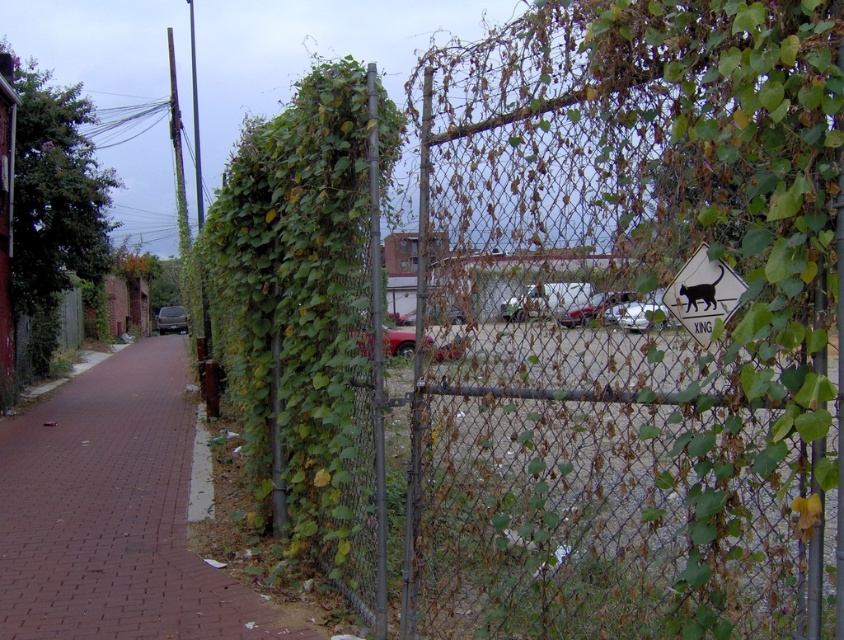
Is brick pavement at lower left above metallic red car at center?

Actually, brick pavement at lower left is below metallic red car at center.

Between point (72, 561) and point (445, 321), which one is positioned in front?

Point (445, 321)

At what (x,y) coordinates should I click in order to perform the action: click on brick pavement at lower left. Please return your answer as a coordinate pair (x, y). This screenshot has height=640, width=844. Looking at the image, I should click on (114, 515).

Is point (680, 280) positioned behind point (171, 330)?

No, (680, 280) is closer to viewer.

From the picture: Measure the distance from white plastic sign at upper right to shiny black sedan at center.

white plastic sign at upper right is 42.32 meters from shiny black sedan at center.

The height and width of the screenshot is (640, 844). I want to click on white plastic sign at upper right, so click(702, 294).

The height and width of the screenshot is (640, 844). What are the coordinates of `white plastic sign at upper right` in the screenshot? It's located at (702, 294).

Who is positioned more to the left, brick pavement at lower left or white plastic sign at upper right?

Positioned to the left is brick pavement at lower left.

Does brick pavement at lower left lie behind white plastic sign at upper right?

Yes, brick pavement at lower left is behind white plastic sign at upper right.

Is point (65, 429) closer to viewer compared to point (680, 292)?

No, (65, 429) is behind (680, 292).

Locate an element on the screen. brick pavement at lower left is located at coordinates (114, 515).